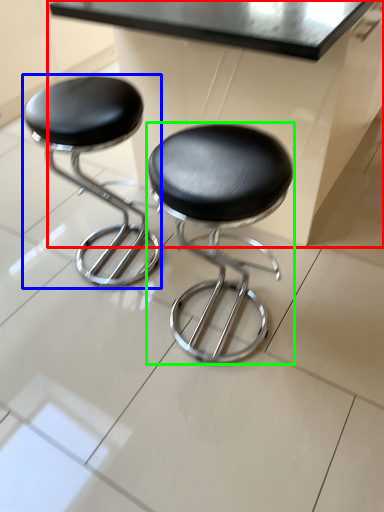
Question: Which object is positioned farthest from table (highlighted by a red box)? Select from stool (highlighted by a blue box) and stool (highlighted by a green box).

Choices:
 (A) stool
 (B) stool

Answer: (A)